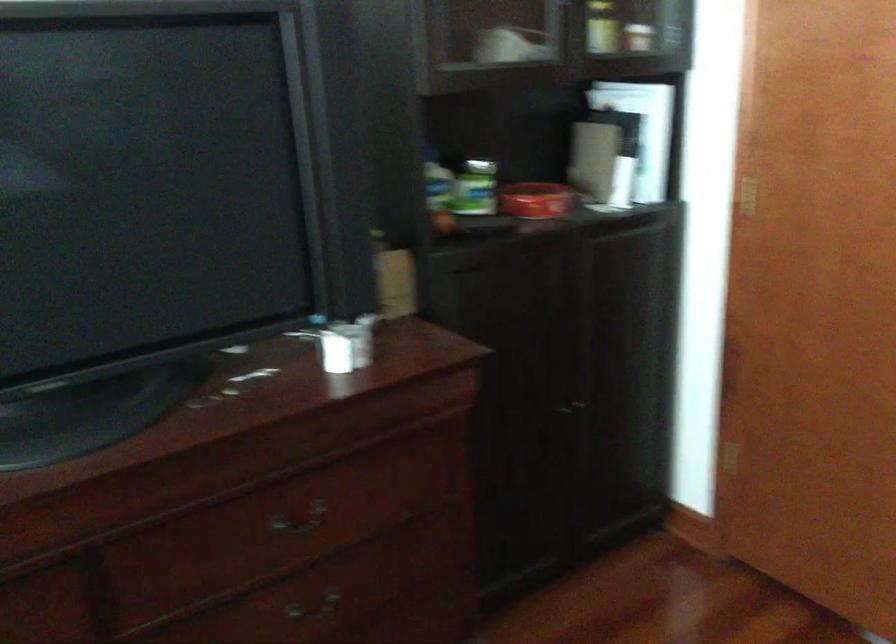
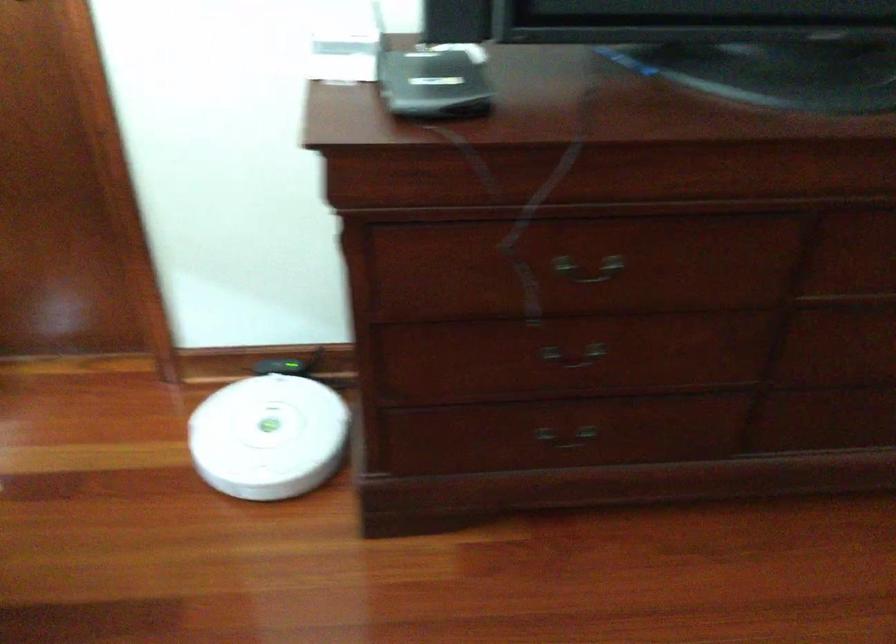
First-person continuous shooting, in which direction is the camera rotating?

The camera's rotation is toward left-down.